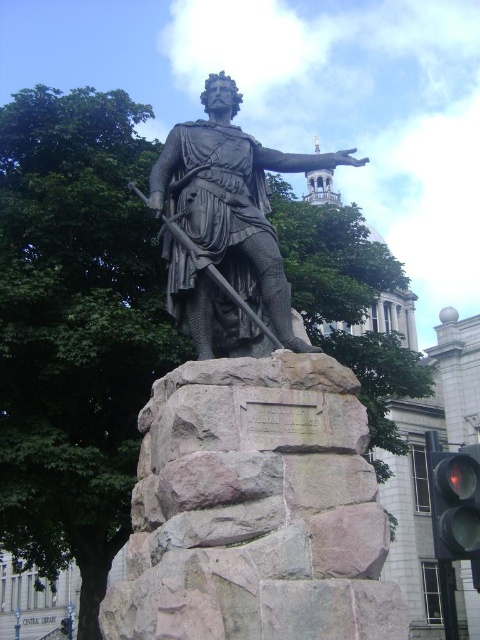
You are a city planner assessing the placement of a new traffic light. The proposed location is near the bronze statue at center and the existing red glass traffic light at lower right. Considering their sizes, which object would be more visually dominant in the area?

The bronze statue at center is larger in size than the red glass traffic light at lower right, making it the more visually dominant object in the area.

What is the significance of the point at coordinates (247, 429) in the image of William Wallace?

The point at coordinates (247, 429) corresponds to the polished bronze statue at center, which is the central focus of the image depicting William Wallace in a dynamic pose holding a sword and gesturing outward, symbolizing his leadership and defiance during Scotland

You are standing in front of the statue of William Wallace and notice two points marked on the pedestal. The first point is at coordinates point (153, 502) and the second is at point (155, 186). Which point is nearer to your viewpoint?

Point (153, 502) is closer to the camera than point (155, 186). Therefore, the first point is nearer to your viewpoint.